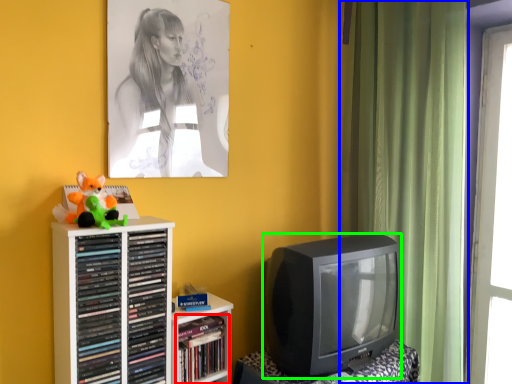
Question: Which object is the farthest from book (highlighted by a red box)? Choose among these: curtain (highlighted by a blue box) or television (highlighted by a green box).

Choices:
 (A) curtain
 (B) television

Answer: (A)